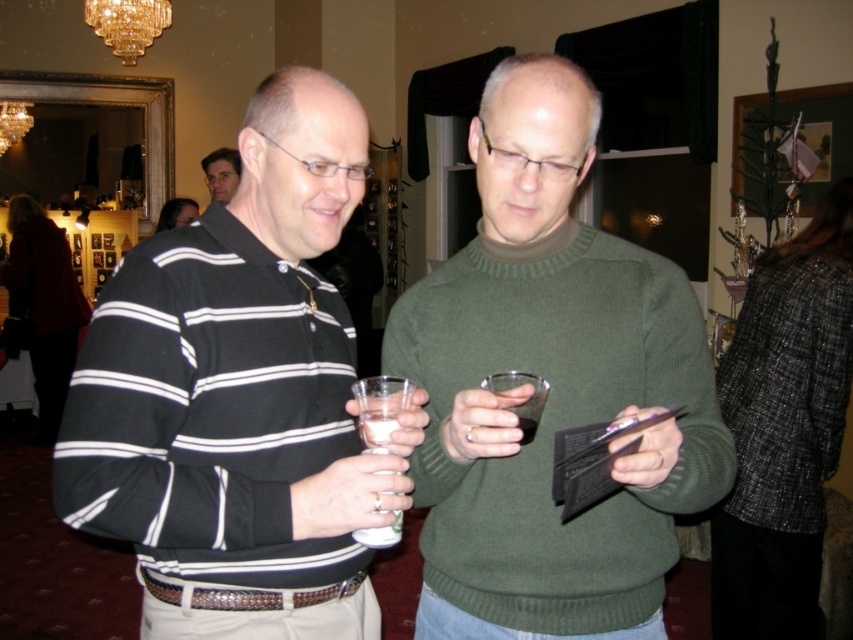
You are at a party and want to grab a drink from the table where the green wool sweater at center and transparent glass at center are located. Which object should you move first to reach the drink?

The transparent glass at center is on the left side of the green wool sweater at center, so you should move the transparent glass at center first to reach the drink.

You are at a party and want to grab a drink without spilling it. You see a clear plastic cup at center and a matte black sweater at upper left. Which object is closer to your right side when facing the scene?

The clear plastic cup at center is positioned on the right side of matte black sweater at upper left, so when facing the scene, the clear plastic cup at center is closer to your right side.